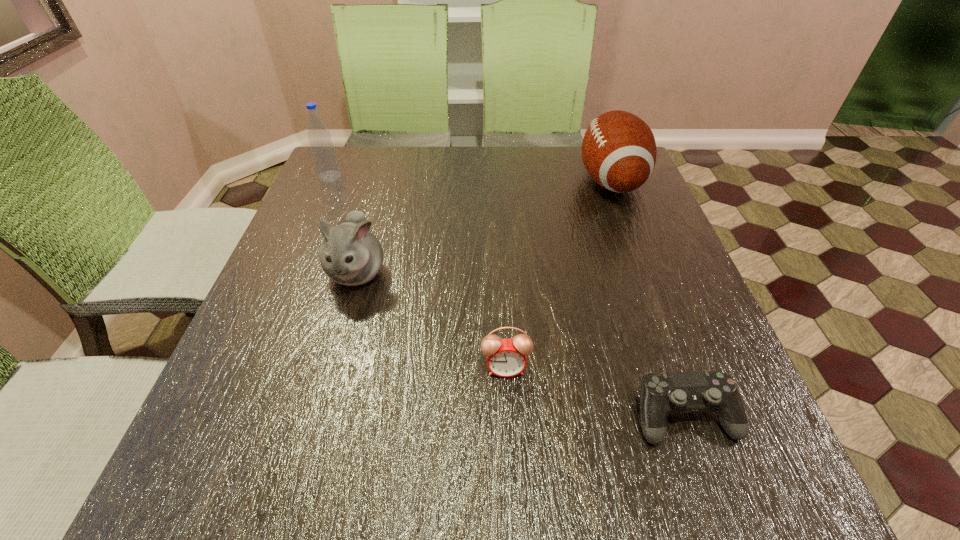
What are the coordinates of `the leftmost object` in the screenshot? It's located at (323, 152).

I want to click on football, so click(619, 151).

At what (x,y) coordinates should I click in order to perform the action: click on the fourth object from right to left. Please return your answer as a coordinate pair (x, y). The image size is (960, 540). Looking at the image, I should click on (351, 254).

Where is `the third farthest object`? The width and height of the screenshot is (960, 540). the third farthest object is located at coordinates (351, 254).

The width and height of the screenshot is (960, 540). Identify the location of the second nearest object. (506, 357).

This screenshot has width=960, height=540. I want to click on alarm clock, so click(x=506, y=357).

You are a GUI agent. You are given a task and a screenshot of the screen. Output one action in this format:
    pyautogui.click(x=<x>, y=<y>)
    Task: Click on the nearest object
    Image resolution: width=960 pixels, height=540 pixels.
    Given the screenshot: What is the action you would take?
    pyautogui.click(x=661, y=394)

Locate an element on the screen. the shortest object is located at coordinates (661, 394).

Image resolution: width=960 pixels, height=540 pixels. I want to click on vacant space situated 0.190m on the right of the leftmost object, so click(x=409, y=177).

Where is `free space located on the laces of the football`? free space located on the laces of the football is located at coordinates (472, 181).